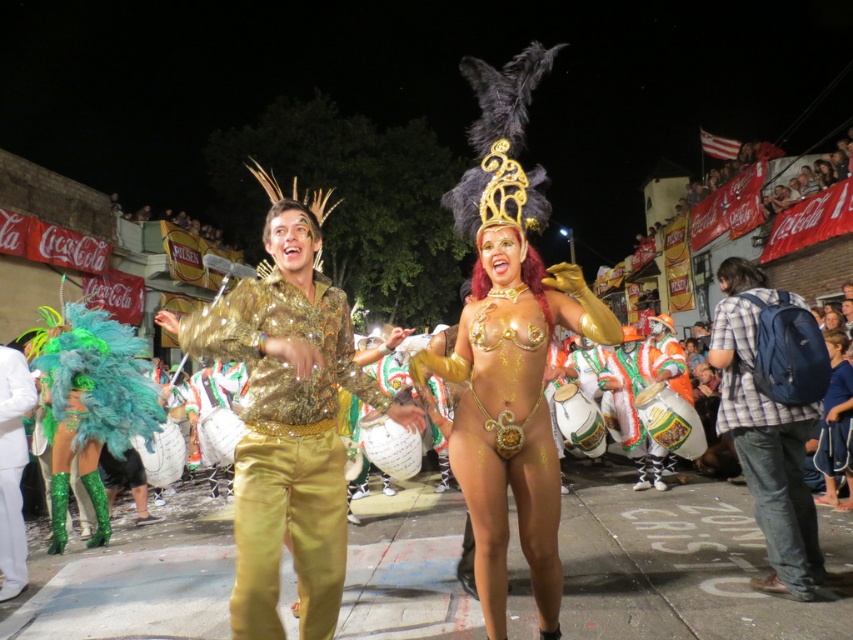
You are a photographer at the parade and want to capture both the blue fabric backpack at right and the blue fabric pants at lower right in a single photo. The camera you are using has a focal length of 50mm. Considering the distance between them, is it possible to frame both items in the shot without moving closer or further away?

The blue fabric backpack at right and blue fabric pants at lower right are 7.73 feet apart from each other. With a 50mm lens, the field of view typically allows capturing objects up to 10 feet apart at a standard distance, so yes, it is possible to frame both in the shot without adjusting your position.

You are a photographer at the carnival trying to capture a photo of the gold sequined shirt at center and the blue fabric backpack at right. Which object should you focus on first if you want to include both in your shot without moving the camera?

The gold sequined shirt at center is above the blue fabric backpack at right, so you should focus on the gold sequined shirt at center first to ensure both are in frame.